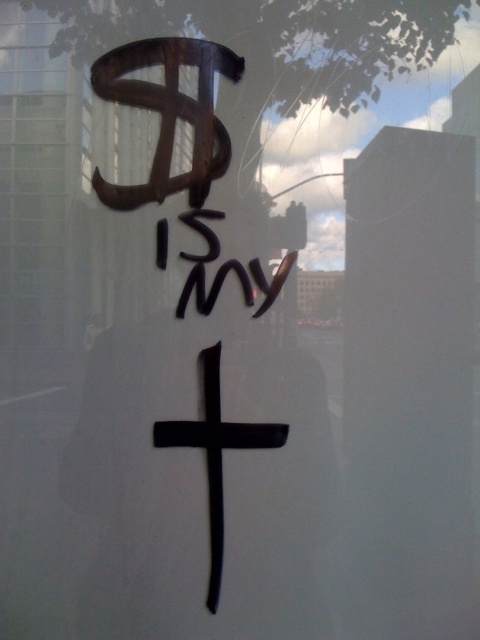
You are standing 1.5 meters away from a reflective surface. You see a point marked at coordinates point (187, 435). Can you reach this point without moving closer to the surface?

The point (187, 435) is 1.43 meters away from the viewer. Since you are already 1.5 meters away from the surface, the point is slightly closer than your current position. You can reach it without moving closer by extending your arm or using a tool.

You are an art restorer examining a reflective window with a black matte cross at center and black ink writing at center. Which object is taller when viewed from the front?

The black matte cross at center is taller than the black ink writing at center.

You are an art restorer examining a reflective surface with two central elements. You need to determine which of the two, the black matte cross at center or the black ink writing at center, requires more space for restoration. Based on their sizes, which one would you prioritize?

The black matte cross at center is bigger than the black ink writing at center, so it would require more space for restoration and should be prioritized.